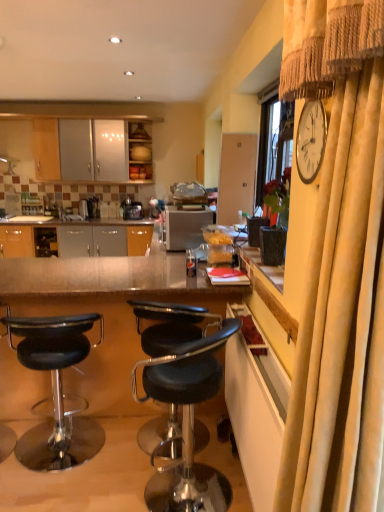
Question: Which is correct: wooden cabinet at upper center, marked as the first cabinetry in a back-to-front arrangement, is inside velvet beige curtain at right, or outside of it?

Choices:
 (A) inside
 (B) outside

Answer: (B)

Question: Is wooden cabinet at upper center, which ranks as the 2th cabinetry in right-to-left order, in front of or behind velvet beige curtain at right in the image?

Choices:
 (A) front
 (B) behind

Answer: (B)

Question: Which of these objects is positioned closest to the metallic/reflective table at center?

Choices:
 (A) black leather stool at lower left, arranged as the 1th chair when viewed from the left
 (B) black leather stool at lower right, marked as the second chair in a left-to-right arrangement
 (C) velvet beige curtain at right
 (D) satin black coffee machine at center, marked as the 1th coffee machine in a right-to-left arrangement
 (E) yellow wood cabinet at right, arranged as the 2th cabinetry when viewed from the top

Answer: (A)

Question: Which object is positioned closest to the satin black coffee machine at center, marked as the 1th coffee machine in a right-to-left arrangement?

Choices:
 (A) wooden cabinet at upper center, placed as the first cabinetry when sorted from left to right
 (B) satin black coffee machine at center, placed as the second coffee machine when sorted from right to left
 (C) satin silver toaster at center
 (D) yellow wood cabinet at right, marked as the second cabinetry in a back-to-front arrangement
 (E) black leather stool at lower left, placed as the 2th chair when sorted from right to left

Answer: (B)